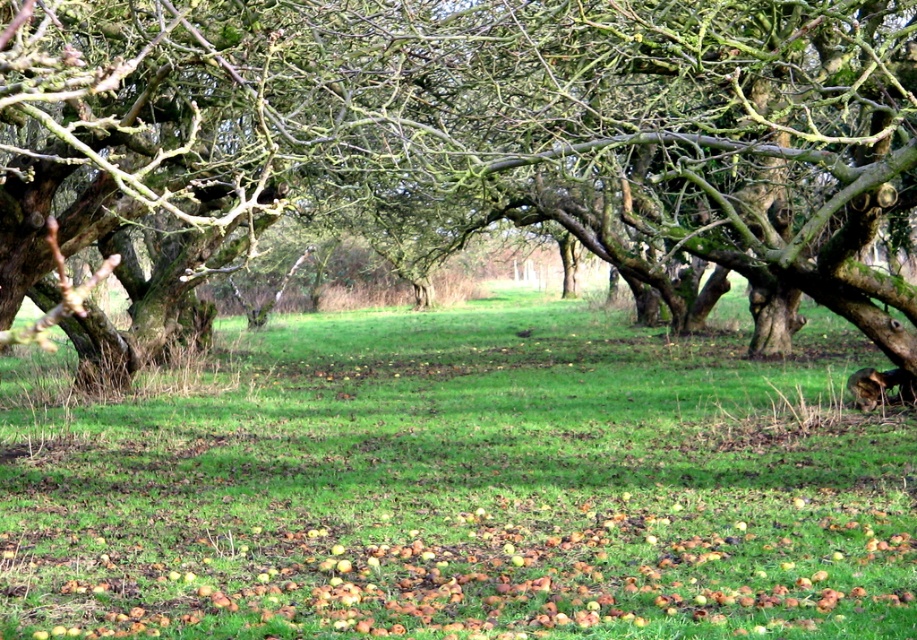
You are standing in the orchard and want to pick an apple from the brown rough tree at center. Which direction should you look to find the green grass at center where apples might have fallen?

The green grass at center is located below the brown rough tree at center, so you should look downward to find the green grass at center where apples might have fallen.

You are standing in the orchard and want to pick an apple from the brown rough tree at center. However, you notice the brown rough apples at lower center on the ground. Which one is closer to your current position?

The brown rough apples at lower center are closer to your current position because they are on the ground, while the brown rough tree at center is above them, meaning it is higher up and farther away.